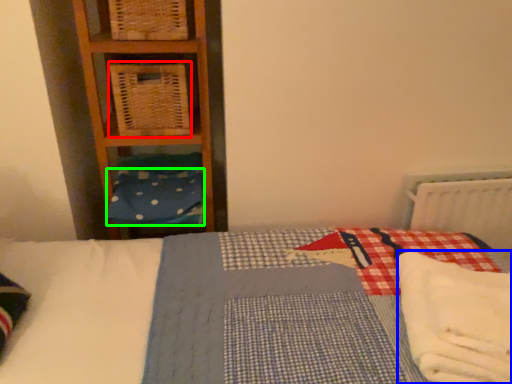
Question: Based on their relative distances, which object is nearer to crate (highlighted by a red box)? Choose from material (highlighted by a blue box) and pillow (highlighted by a green box).

Choices:
 (A) material
 (B) pillow

Answer: (B)